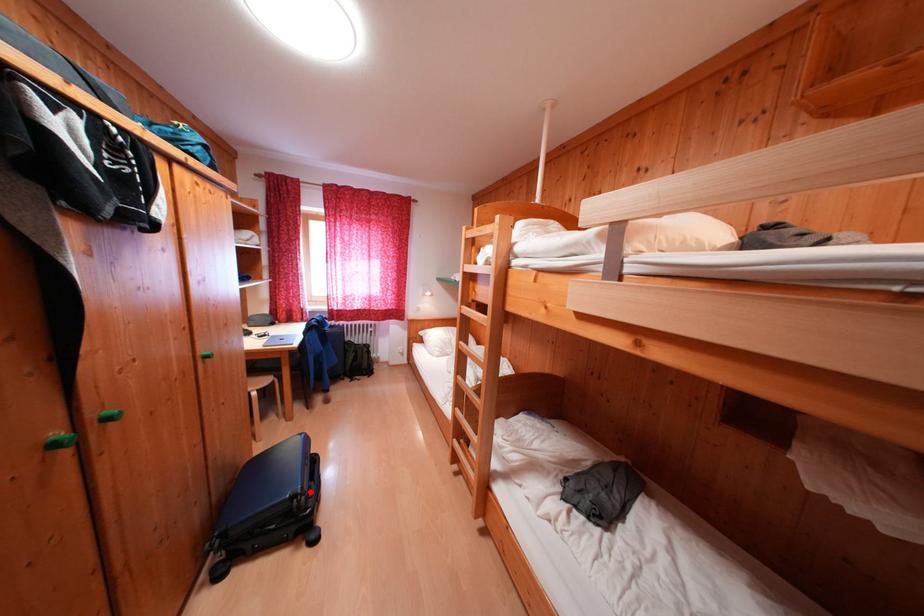
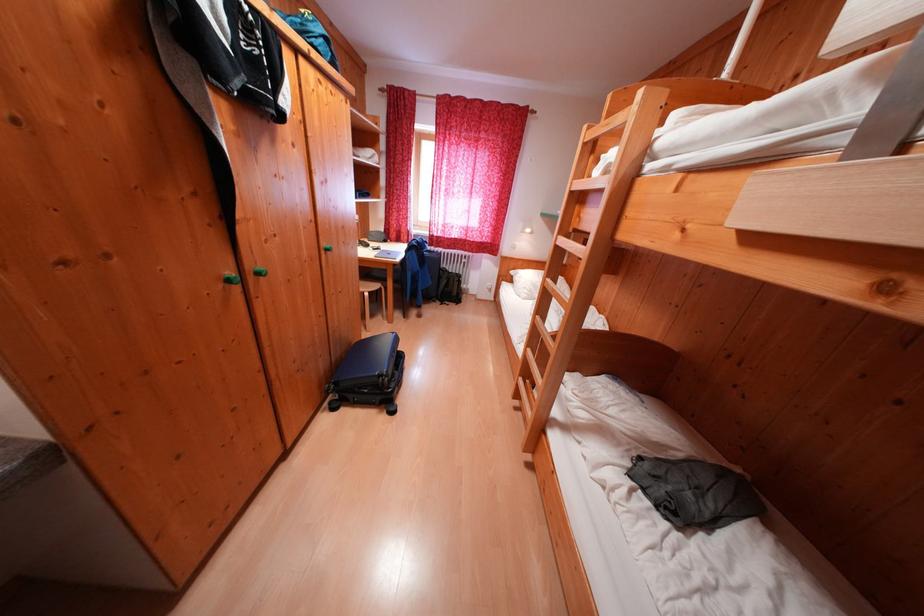
The point at the highlighted location is marked in the first image. Where is the corresponding point in the second image?

(395, 376)